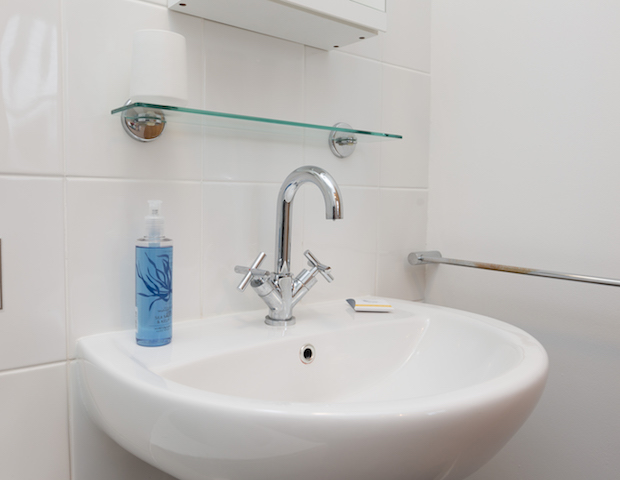
What are the coordinates of `glass shelf` in the screenshot? It's located at (232, 125).